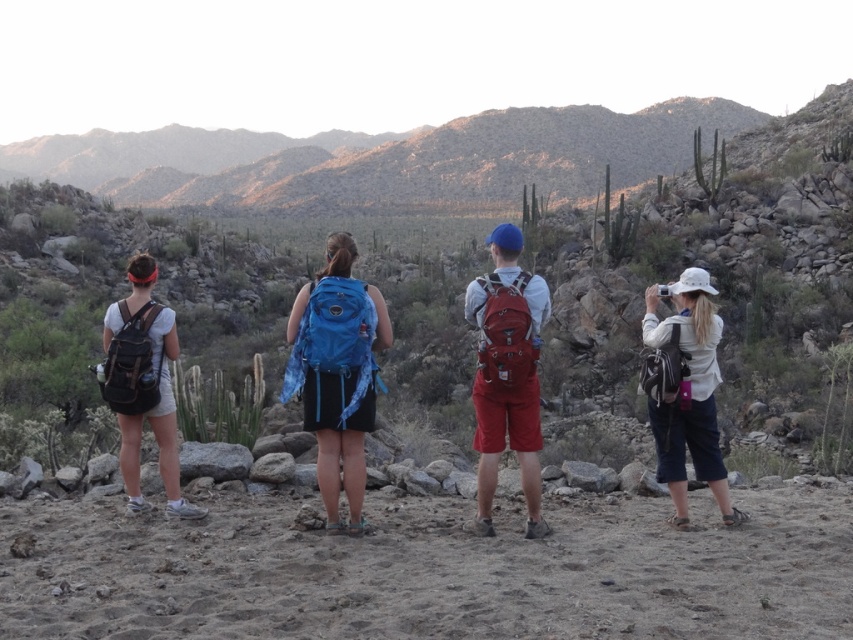
Consider the image. Is blue fabric backpack at center positioned at the back of matte black backpack at left?

No, blue fabric backpack at center is in front of matte black backpack at left.

Based on the photo, can you confirm if blue fabric backpack at center is positioned to the right of matte black backpack at left?

Yes, blue fabric backpack at center is to the right of matte black backpack at left.

Does point (358, 477) lie behind point (201, 515)?

No, it is not.

You are a GUI agent. You are given a task and a screenshot of the screen. Output one action in this format:
    pyautogui.click(x=<x>, y=<y>)
    Task: Click on the blue fabric backpack at center
    The image size is (853, 640).
    Given the screenshot: What is the action you would take?
    pyautogui.click(x=337, y=374)

Between blue fabric backpack at center and white matte hat at right, which one has less height?

white matte hat at right is shorter.

Is point (357, 289) behind point (712, 289)?

Yes, point (357, 289) is behind point (712, 289).

Which is in front, point (354, 356) or point (666, 342)?

Positioned in front is point (354, 356).

Find the location of a particular element. blue fabric backpack at center is located at coordinates (337, 374).

Who is higher up, blue fabric backpack at center or matte red backpack at center?

blue fabric backpack at center is above.

Is blue fabric backpack at center to the left of matte red backpack at center from the viewer's perspective?

Correct, you'll find blue fabric backpack at center to the left of matte red backpack at center.

Which is in front, point (334, 426) or point (525, 419)?

Point (334, 426) is in front.

Where is `blue fabric backpack at center`? The image size is (853, 640). blue fabric backpack at center is located at coordinates (337, 374).